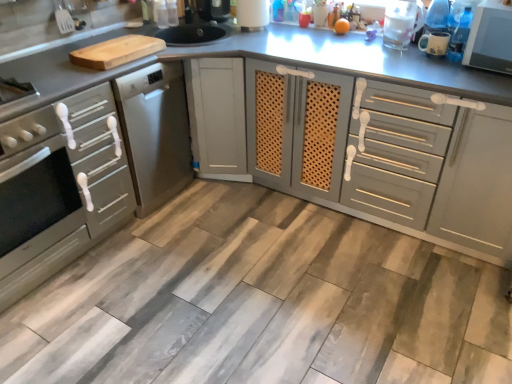
Locate an element on the screen. This screenshot has height=384, width=512. empty space that is in between transparent plastic pitcher at upper right, marked as the 2th appliance in a left-to-right arrangement, and white textured paper towel holder at upper center, placed as the third appliance when sorted from front to back is located at coordinates (310, 38).